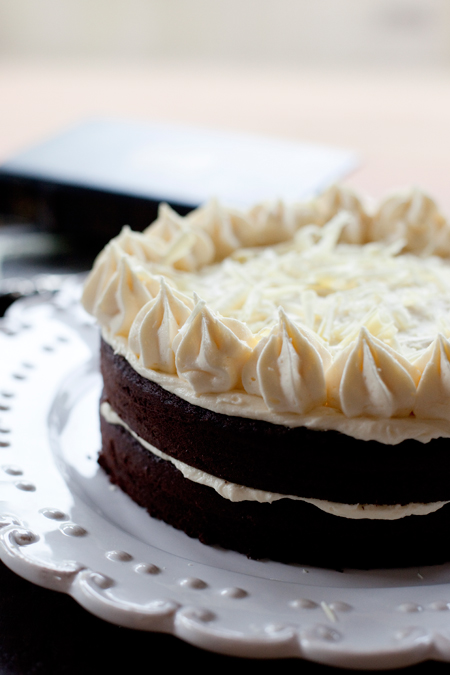
Identify the location of cake platter. (170, 578).